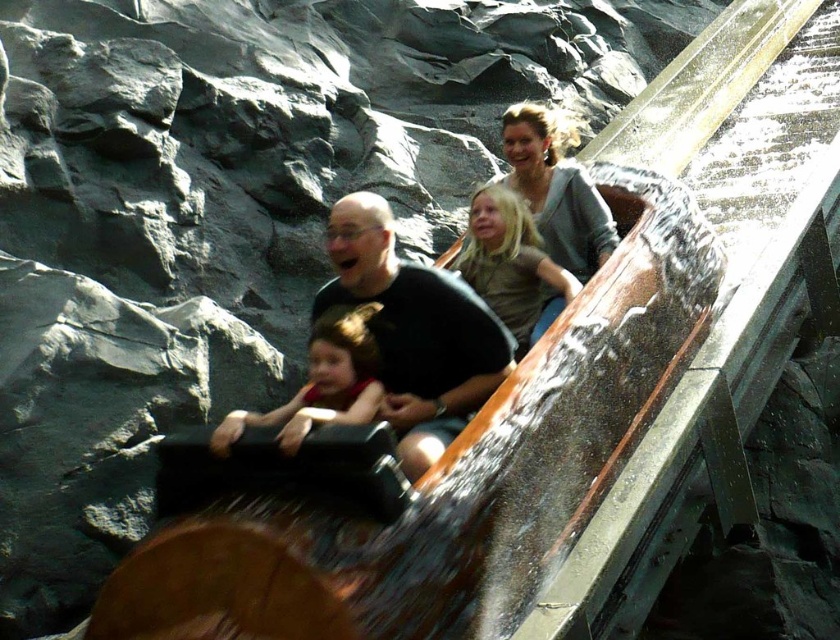
Looking at this image, can you confirm if matte gray sweater at upper center is taller than matte red shirt at center?

Yes, matte gray sweater at upper center is taller than matte red shirt at center.

Is point (571, 272) closer to viewer compared to point (308, 388)?

No, it is behind (308, 388).

At what (x,y) coordinates should I click in order to perform the action: click on matte gray sweater at upper center. Please return your answer as a coordinate pair (x, y). This screenshot has width=840, height=640. Looking at the image, I should click on (555, 188).

The width and height of the screenshot is (840, 640). What are the coordinates of `black matte shirt at center` in the screenshot? It's located at (413, 332).

Who is positioned more to the left, black matte shirt at center or matte red shirt at center?

matte red shirt at center

Is point (444, 369) positioned behind point (350, 364)?

Yes.

Find the location of a particular element. black matte shirt at center is located at coordinates (413, 332).

How distant is matte red shirt at center from matte gray shirt at center?

matte red shirt at center and matte gray shirt at center are 6.48 meters apart from each other.

Is point (348, 307) less distant than point (483, 220)?

Yes, point (348, 307) is in front of point (483, 220).

Describe the element at coordinates (321, 384) in the screenshot. I see `matte red shirt at center` at that location.

At what (x,y) coordinates should I click in order to perform the action: click on matte red shirt at center. Please return your answer as a coordinate pair (x, y). Looking at the image, I should click on (321, 384).